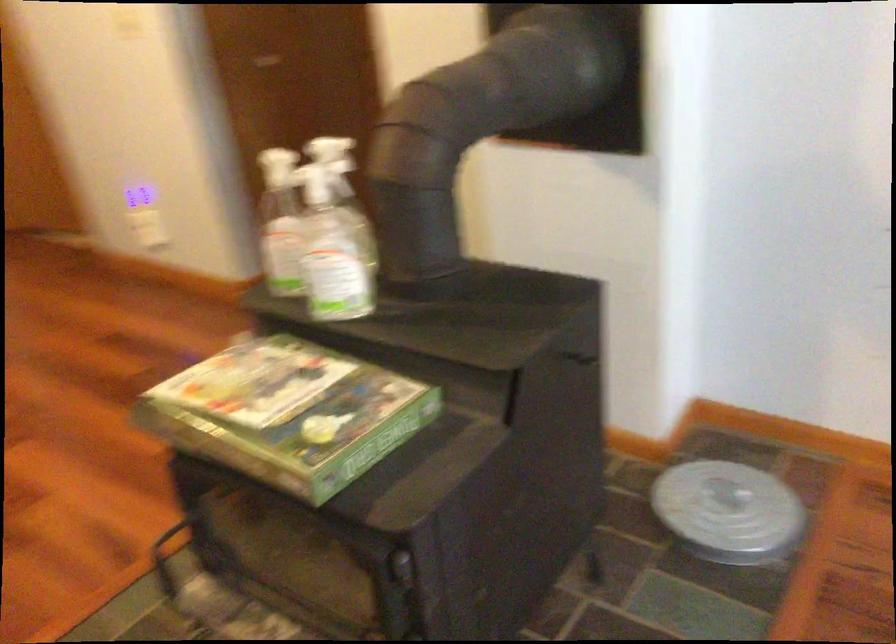
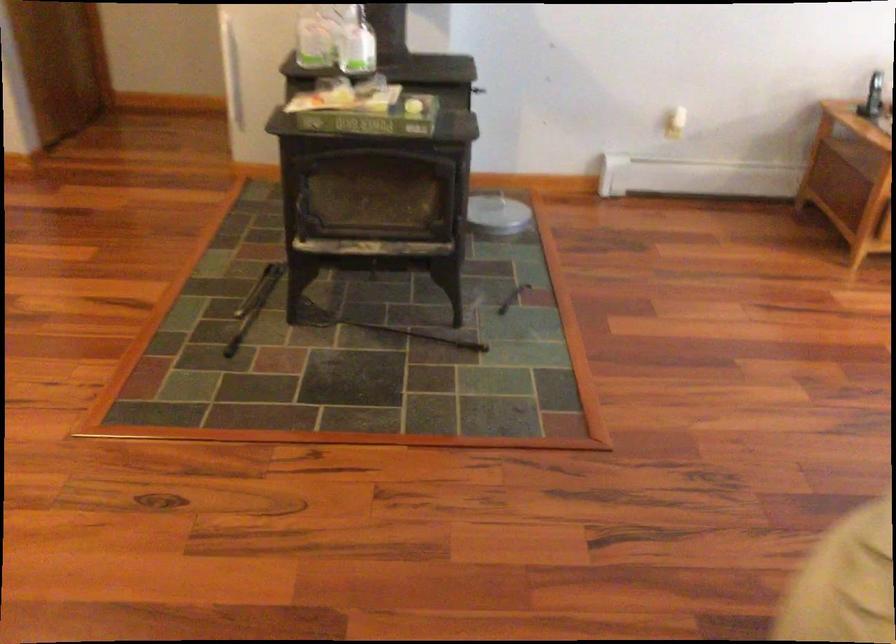
In the second image, find the point that corresponds to [325,277] in the first image.

(357, 46)